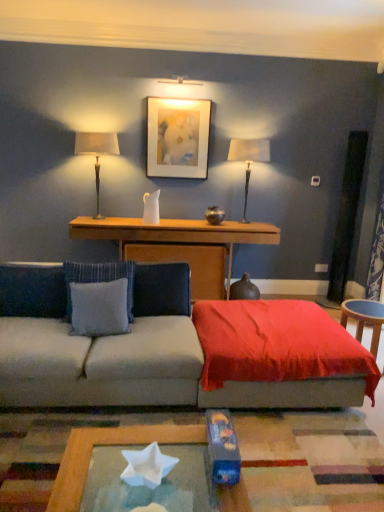
Identify the location of matte white lampshade at right, the 1th table lamp viewed from the right. The height and width of the screenshot is (512, 384). (249, 158).

Image resolution: width=384 pixels, height=512 pixels. Describe the element at coordinates (32, 290) in the screenshot. I see `blue fabric pillow at left, acting as the 3th pillow starting from the right` at that location.

The width and height of the screenshot is (384, 512). Describe the element at coordinates (99, 308) in the screenshot. I see `gray fabric pillow at center, which is the 2th pillow from left to right` at that location.

The width and height of the screenshot is (384, 512). Describe the element at coordinates (177, 137) in the screenshot. I see `matte white picture frame at upper center` at that location.

The image size is (384, 512). In order to click on blue fabric pillow at center, which is the 1th pillow from right to left in this screenshot , I will do `click(161, 289)`.

Measure the distance between wooden round table at right, the 2th table when ordered from left to right, and camera.

2.96 meters.

Locate an element on the screen. The width and height of the screenshot is (384, 512). matte white lampshade at right, positioned as the second table lamp in left-to-right order is located at coordinates (249, 158).

Relative to blue fabric pillow at center, which is the 1th pillow from right to left, is wooden console at center, the 1th table viewed from the left, in front or behind?

Clearly, wooden console at center, the 1th table viewed from the left, is behind blue fabric pillow at center, which is the 1th pillow from right to left.

Is wooden console at center, the first table when ordered from back to front, not inside blue fabric pillow at center, the 3th pillow in the left-to-right sequence?

Yes, wooden console at center, the first table when ordered from back to front, is not within blue fabric pillow at center, the 3th pillow in the left-to-right sequence.

Consider the image. Is wooden console at center, the first table when ordered from back to front, taller than blue fabric pillow at center, which is the 1th pillow from right to left?

Yes.

From their relative heights in the image, would you say wooden console at center, which ranks as the second table in front-to-back order, is taller or shorter than matte white lampshade at right, positioned as the second table lamp in left-to-right order?

Clearly, wooden console at center, which ranks as the second table in front-to-back order, is shorter compared to matte white lampshade at right, positioned as the second table lamp in left-to-right order.

Based on the photo, would you consider wooden console at center, which is the second table from right to left, to be distant from matte white lampshade at right, the 1th table lamp viewed from the right?

They are positioned close to each other.

Does wooden console at center, which ranks as the second table in front-to-back order, have a greater width compared to matte white lampshade at right, positioned as the second table lamp in left-to-right order?

Yes.

Who is smaller, wooden round table at right, the 2th table when ordered from left to right, or blue fabric pillow at left, the 1th pillow from the left?

wooden round table at right, the 2th table when ordered from left to right.

Measure the distance between wooden round table at right, arranged as the second table when viewed from the back, and blue fabric pillow at left, the 1th pillow from the left.

wooden round table at right, arranged as the second table when viewed from the back, and blue fabric pillow at left, the 1th pillow from the left, are 2.23 meters apart from each other.

From a real-world perspective, count 2nd pillows upward from the wooden round table at right, the 1th table viewed from the right, and point to it. Please provide its 2D coordinates.

[(32, 290)]

Considering the relative sizes of wooden round table at right, the 1th table positioned from the front, and blue fabric pillow at left, acting as the 3th pillow starting from the right, in the image provided, is wooden round table at right, the 1th table positioned from the front, taller than blue fabric pillow at left, acting as the 3th pillow starting from the right,?

No, wooden round table at right, the 1th table positioned from the front, is not taller than blue fabric pillow at left, acting as the 3th pillow starting from the right.

From a real-world perspective, which is physically below, matte white picture frame at upper center or matte white lampshade at right, positioned as the second table lamp in left-to-right order?

From a 3D spatial view, matte white lampshade at right, positioned as the second table lamp in left-to-right order, is below.

Can you confirm if matte white picture frame at upper center is shorter than matte white lampshade at right, the 1th table lamp viewed from the right?

Yes, matte white picture frame at upper center is shorter than matte white lampshade at right, the 1th table lamp viewed from the right.

Does matte white picture frame at upper center lie behind matte white lampshade at right, positioned as the second table lamp in left-to-right order?

Yes, matte white picture frame at upper center is further from the viewer.

Does matte white picture frame at upper center have a lesser width compared to matte white lampshade at right, positioned as the second table lamp in left-to-right order?

Indeed, matte white picture frame at upper center has a lesser width compared to matte white lampshade at right, positioned as the second table lamp in left-to-right order.

Is matte white lampshade at right, positioned as the second table lamp in left-to-right order, at the back of gray fabric pillow at center, which is the 2th pillow from left to right?

gray fabric pillow at center, which is the 2th pillow from left to right, does not have its back to matte white lampshade at right, positioned as the second table lamp in left-to-right order.

From the picture: From a real-world perspective, who is located higher, gray fabric pillow at center, which is the 2th pillow from left to right, or matte white lampshade at right, the 1th table lamp viewed from the right?

matte white lampshade at right, the 1th table lamp viewed from the right, is physically above.

From the image's perspective, is gray fabric pillow at center, the second pillow viewed from the right, located above matte white lampshade at right, the 1th table lamp viewed from the right?

No, from the image's perspective, gray fabric pillow at center, the second pillow viewed from the right, is not above matte white lampshade at right, the 1th table lamp viewed from the right.

In the image, there is a gray fabric pillow at center, which is the 2th pillow from left to right. Identify the location of bedding below it (from the image's perspective). (278, 355).

Is gray fabric pillow at center, which is the 2th pillow from left to right, positioned with its back to velvet red throw at center?

No.

Is gray fabric pillow at center, the second pillow viewed from the right, outside of velvet red throw at center?

Yes, gray fabric pillow at center, the second pillow viewed from the right, is located beyond the bounds of velvet red throw at center.

In terms of height, does gray fabric pillow at center, the second pillow viewed from the right, look taller or shorter compared to velvet red throw at center?

gray fabric pillow at center, the second pillow viewed from the right, is taller than velvet red throw at center.

Is point (29, 301) less distant than point (175, 228)?

Yes, point (29, 301) is in front of point (175, 228).

From a real-world perspective, is blue fabric pillow at left, acting as the 3th pillow starting from the right, located beneath wooden console at center, the first table when ordered from back to front?

No, from a real-world perspective, blue fabric pillow at left, acting as the 3th pillow starting from the right, is not below wooden console at center, the first table when ordered from back to front.

Considering the sizes of blue fabric pillow at left, acting as the 3th pillow starting from the right, and wooden console at center, which ranks as the second table in front-to-back order, in the image, is blue fabric pillow at left, acting as the 3th pillow starting from the right, wider or thinner than wooden console at center, which ranks as the second table in front-to-back order,?

blue fabric pillow at left, acting as the 3th pillow starting from the right, is thinner than wooden console at center, which ranks as the second table in front-to-back order.

Is blue fabric pillow at left, the 1th pillow from the left, not inside wooden console at center, which is the second table from right to left?

blue fabric pillow at left, the 1th pillow from the left, lies outside wooden console at center, which is the second table from right to left,'s area.

Starting from the blue fabric pillow at center, the 3th pillow in the left-to-right sequence, which table is the 1st one to the right? Please provide its 2D coordinates.

[(174, 233)]

Find the location of a particular element. This screenshot has height=512, width=384. table on the left of the matte white lampshade at right, positioned as the second table lamp in left-to-right order is located at coordinates (174, 233).

From the image, which object appears to be farther from matte white picture frame at upper center, satin beige lampshade at left, marked as the 2th table lamp in a right-to-left arrangement, or matte white lampshade at right, the 1th table lamp viewed from the right?

Among the two, satin beige lampshade at left, marked as the 2th table lamp in a right-to-left arrangement, is located further to matte white picture frame at upper center.

Estimate the real-world distances between objects in this image. Which object is closer to blue fabric pillow at left, acting as the 3th pillow starting from the right, blue fabric pillow at center, which is the 1th pillow from right to left, or matte white picture frame at upper center?

blue fabric pillow at center, which is the 1th pillow from right to left.

Considering their positions, is velvet red throw at center positioned further to matte white picture frame at upper center than blue fabric pillow at center, the 3th pillow in the left-to-right sequence?

Based on the image, velvet red throw at center appears to be further to matte white picture frame at upper center.

When comparing their distances from blue fabric pillow at left, the 1th pillow from the left, does wooden round table at right, arranged as the second table when viewed from the back, or velvet red throw at center seem closer?

velvet red throw at center lies closer to blue fabric pillow at left, the 1th pillow from the left, than the other object.

Estimate the real-world distances between objects in this image. Which object is further from matte white lampshade at right, positioned as the second table lamp in left-to-right order, gray fabric pillow at center, the second pillow viewed from the right, or blue fabric pillow at left, acting as the 3th pillow starting from the right?

blue fabric pillow at left, acting as the 3th pillow starting from the right.

Looking at the image, which one is located further to blue fabric pillow at left, acting as the 3th pillow starting from the right, blue fabric pillow at center, which is the 1th pillow from right to left, or wooden round table at right, arranged as the second table when viewed from the back?

wooden round table at right, arranged as the second table when viewed from the back, lies further to blue fabric pillow at left, acting as the 3th pillow starting from the right, than the other object.

In the scene shown: Considering their positions, is blue fabric pillow at left, the 1th pillow from the left, positioned closer to wooden round table at right, the 2th table when ordered from left to right, than matte white picture frame at upper center?

Result: blue fabric pillow at left, the 1th pillow from the left, is positioned closer to the anchor wooden round table at right, the 2th table when ordered from left to right.

When comparing their distances from blue fabric pillow at left, the 1th pillow from the left, does blue fabric pillow at center, the 3th pillow in the left-to-right sequence, or gray fabric pillow at center, the second pillow viewed from the right, seem closer?

gray fabric pillow at center, the second pillow viewed from the right, lies closer to blue fabric pillow at left, the 1th pillow from the left, than the other object.

Identify the location of picture frame between blue fabric pillow at left, the 1th pillow from the left, and wooden round table at right, arranged as the second table when viewed from the back. Image resolution: width=384 pixels, height=512 pixels. (177, 137).

Locate an element on the screen. This screenshot has width=384, height=512. pillow situated between gray fabric pillow at center, the second pillow viewed from the right, and wooden round table at right, the 1th table positioned from the front, from left to right is located at coordinates (161, 289).

I want to click on table between velvet red throw at center and wooden console at center, which is the second table from right to left, from front to back, so (364, 319).

You are a GUI agent. You are given a task and a screenshot of the screen. Output one action in this format:
    pyautogui.click(x=<x>, y=<y>)
    Task: Click on the table that lies between matte white picture frame at upper center and wooden round table at right, the 2th table when ordered from left to right, from top to bottom
    
    Given the screenshot: What is the action you would take?
    pyautogui.click(x=174, y=233)